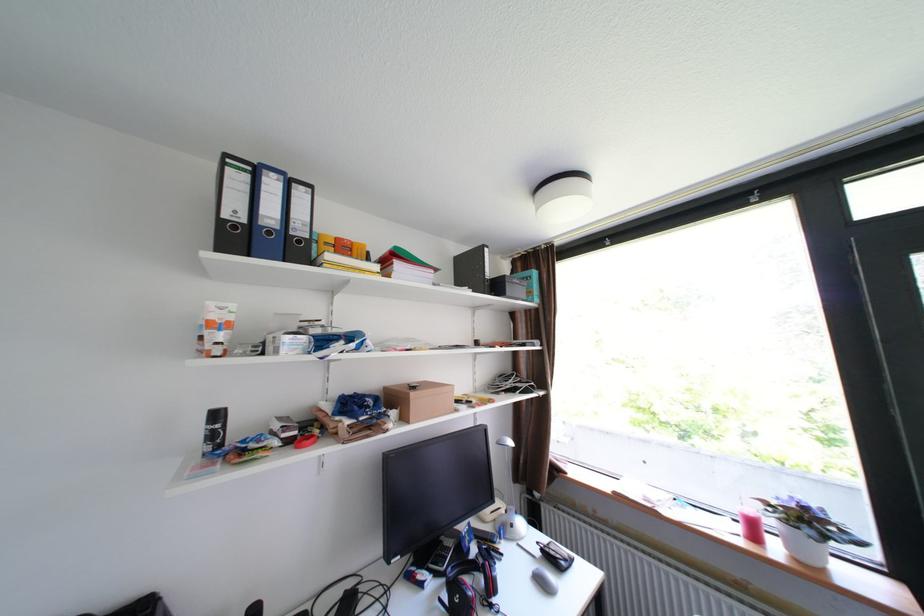
Find where to lift the pink drinking glass. Please return your answer as a coordinate pair (x, y).

(750, 524)